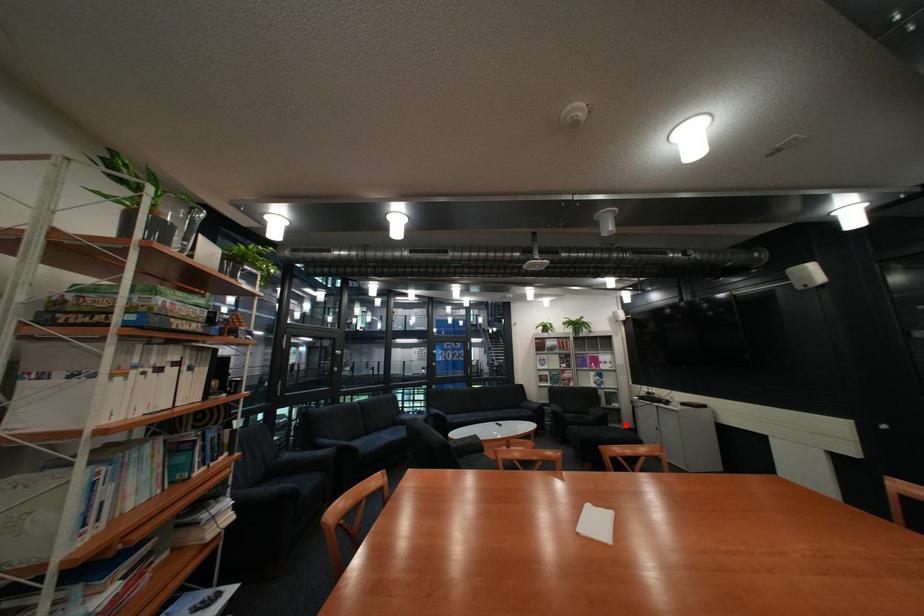
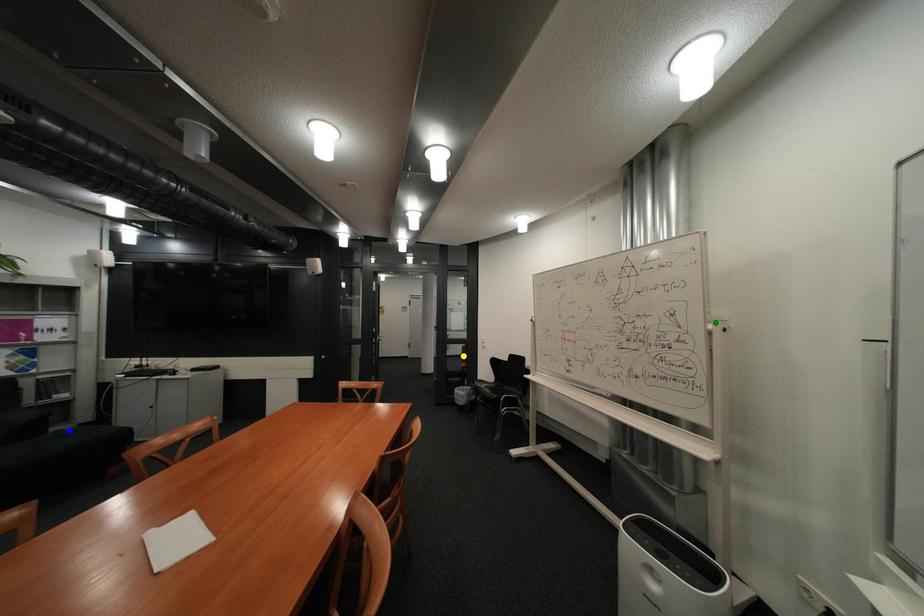
Question: I am providing you with two images of the same scene from different viewpoints. A red point is marked on the first image. You are given multiple points on the second image. Which spot in image 2 lines up with the point in image 1?

Choices:
 (A) yellow point
 (B) blue point
 (C) green point

Answer: (B)